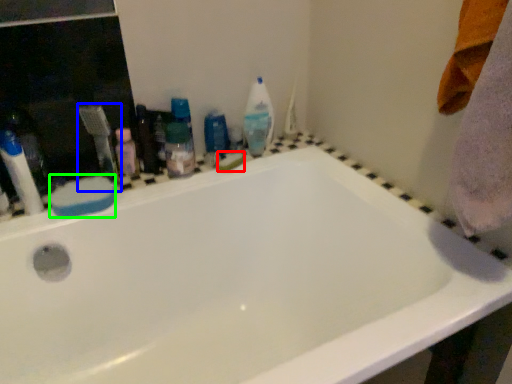
Question: Which object is the closest to the soap (highlighted by a red box)? Choose among these: toothbrush (highlighted by a blue box) or soap (highlighted by a green box).

Choices:
 (A) toothbrush
 (B) soap

Answer: (A)